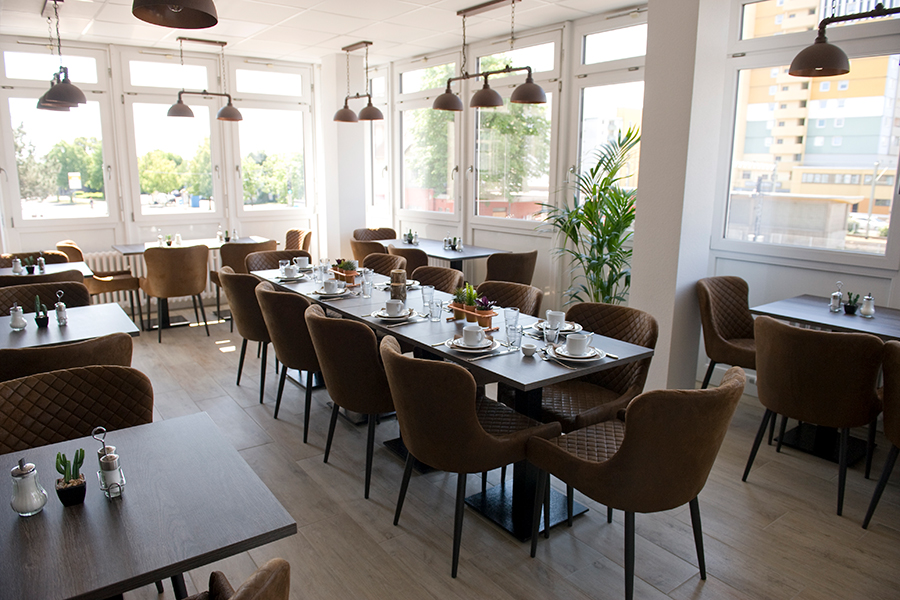
This screenshot has width=900, height=600. I want to click on tables, so click(x=805, y=309), click(x=429, y=331), click(x=437, y=255), click(x=210, y=246), click(x=83, y=263), click(x=90, y=326), click(x=166, y=502).